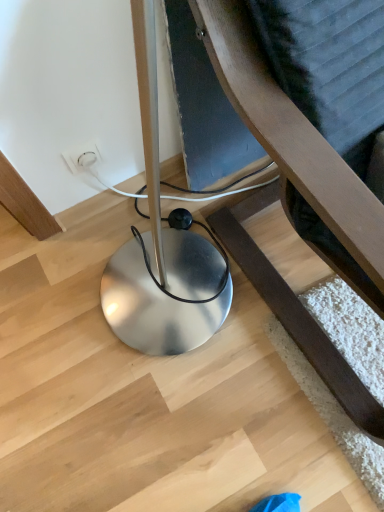
Question: From a real-world perspective, is white plastic outlet at center physically located above or below metallic silver lamp at lower left?

Choices:
 (A) below
 (B) above

Answer: (A)

Question: Is point (79, 144) positioned closer to the camera than point (274, 295)?

Choices:
 (A) farther
 (B) closer

Answer: (B)

Question: Is white plastic outlet at center taller or shorter than metallic silver lamp at lower left?

Choices:
 (A) short
 (B) tall

Answer: (A)

Question: Would you say metallic silver lamp at lower left is inside or outside white plastic outlet at center?

Choices:
 (A) inside
 (B) outside

Answer: (B)

Question: Is point (243, 10) positioned closer to the camera than point (79, 146)?

Choices:
 (A) farther
 (B) closer

Answer: (B)

Question: Relative to white plastic outlet at center, is metallic silver lamp at lower left in front or behind?

Choices:
 (A) front
 (B) behind

Answer: (A)

Question: Considering the positions of metallic silver lamp at lower left and white plastic outlet at center in the image, is metallic silver lamp at lower left bigger or smaller than white plastic outlet at center?

Choices:
 (A) small
 (B) big

Answer: (B)